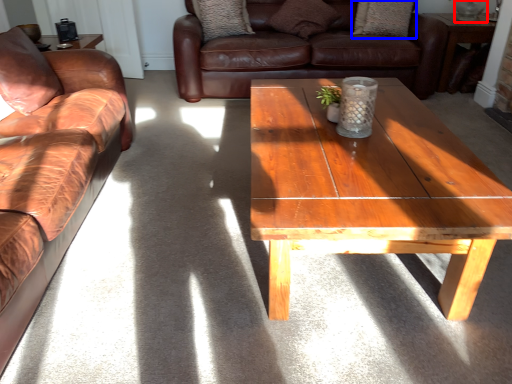
Question: Which of the following is the farthest to the observer, glass vase (highlighted by a red box) or pillow (highlighted by a blue box)?

Choices:
 (A) glass vase
 (B) pillow

Answer: (B)